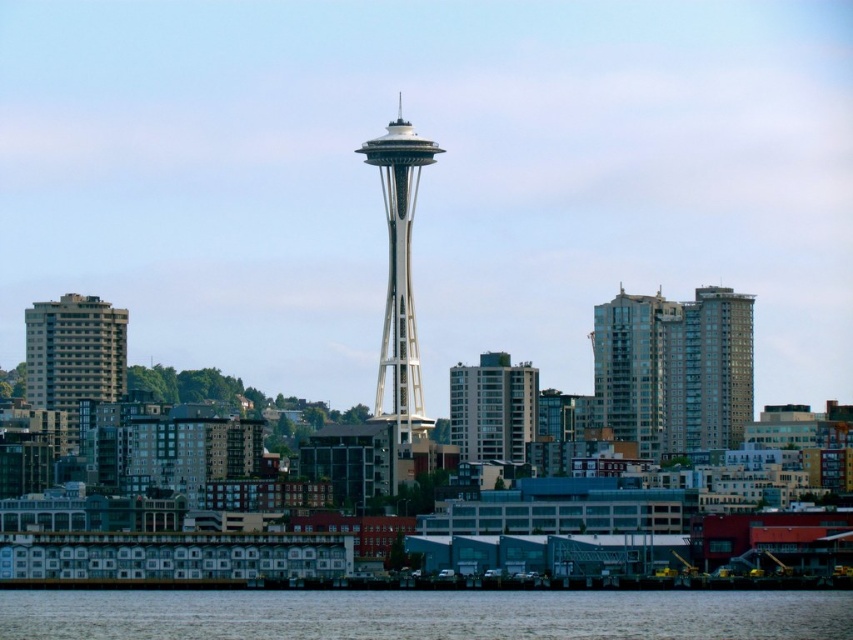
Is point (300, 609) positioned in front of point (393, 296)?

That is False.

Can you confirm if transparent water at lower center is positioned above white metallic space needle at center?

Actually, transparent water at lower center is below white metallic space needle at center.

Find the location of `transparent water at lower center`. transparent water at lower center is located at coordinates (425, 614).

Can you confirm if transparent water at lower center is wider than matte glass building at center?

Correct, the width of transparent water at lower center exceeds that of matte glass building at center.

Does point (154, 625) come in front of point (514, 380)?

That is False.

At what (x,y) coordinates should I click in order to perform the action: click on transparent water at lower center. Please return your answer as a coordinate pair (x, y). Looking at the image, I should click on (425, 614).

Is glassy gray skyscraper at center-right to the right of white metallic space needle at center from the viewer's perspective?

Indeed, glassy gray skyscraper at center-right is positioned on the right side of white metallic space needle at center.

Is glassy gray skyscraper at center-right above white metallic space needle at center?

No.

Where is `glassy gray skyscraper at center-right`? glassy gray skyscraper at center-right is located at coordinates (639, 371).